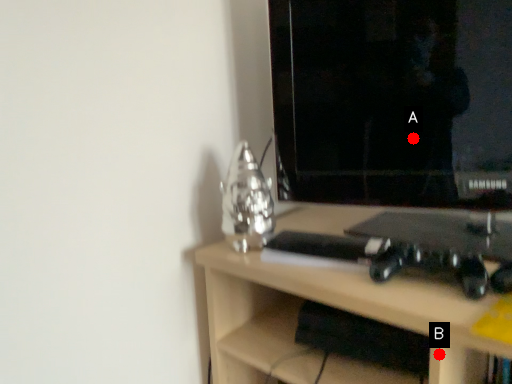
Question: Two points are circled on the image, labeled by A and B beside each circle. Which of the following is the closest to the observer?

Choices:
 (A) A is closer
 (B) B is closer

Answer: (B)